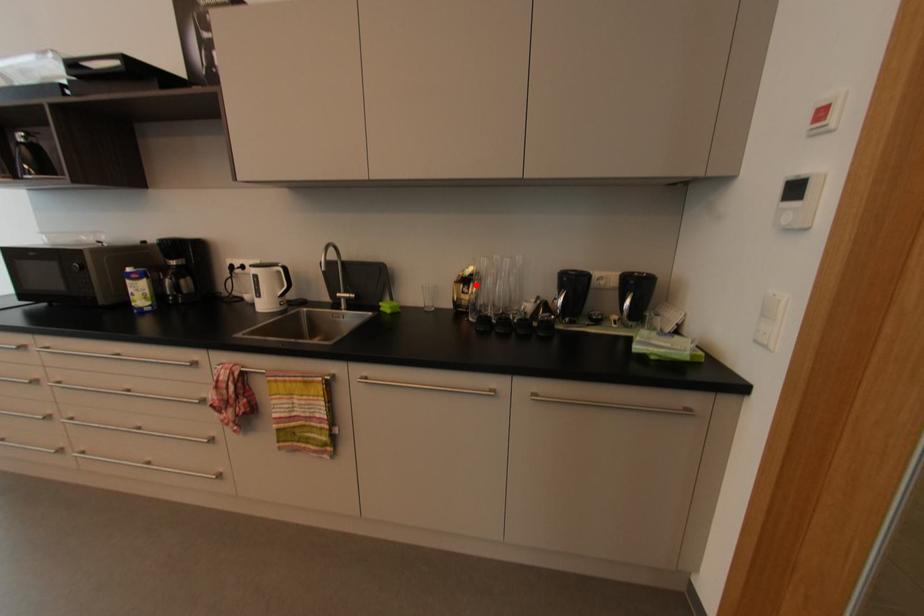
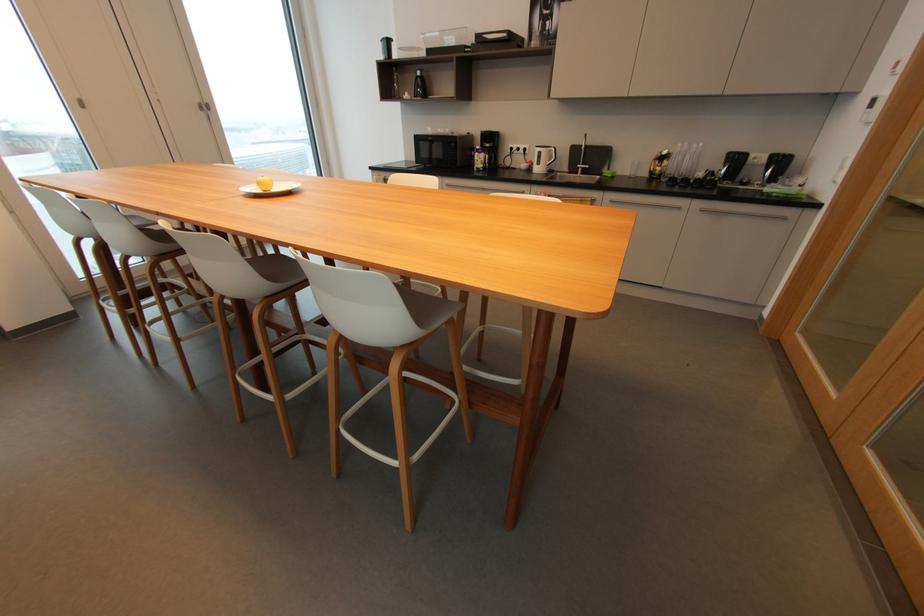
Find the pixel in the second image that matches the highlighted location in the first image.

(669, 161)